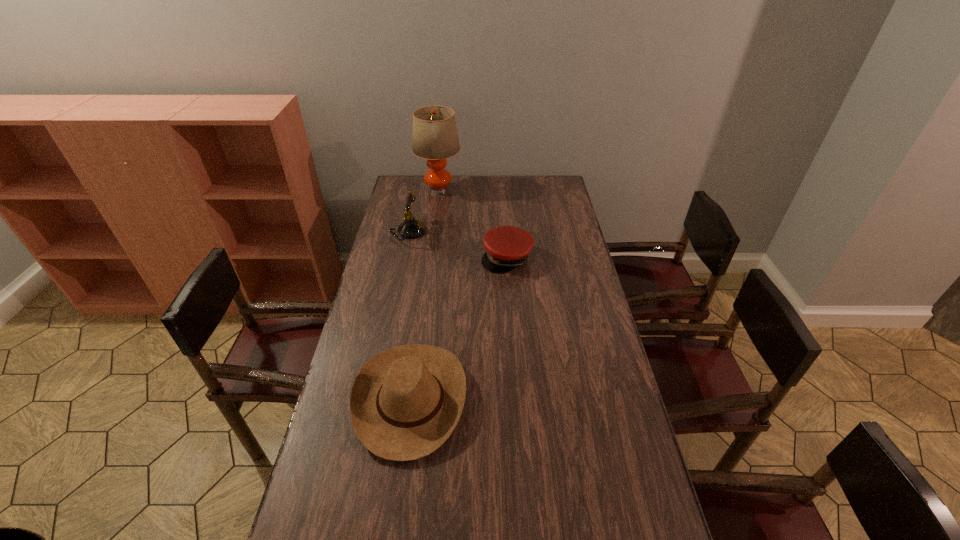
You are a GUI agent. You are given a task and a screenshot of the screen. Output one action in this format:
    pyautogui.click(x=<x>, y=<y>)
    Task: Click on the tallest object
    
    Given the screenshot: What is the action you would take?
    pyautogui.click(x=435, y=137)

Where is `the farthest object`? Image resolution: width=960 pixels, height=540 pixels. the farthest object is located at coordinates (435, 137).

Identify the location of telephone. (411, 228).

Identify the location of the nearest object. The image size is (960, 540). (405, 402).

Where is `the shortest object`? This screenshot has height=540, width=960. the shortest object is located at coordinates (507, 247).

This screenshot has width=960, height=540. In order to click on cap in this screenshot , I will do pyautogui.click(x=507, y=247).

I want to click on vacant space situated on the right of the lamp, so click(x=498, y=189).

Locate an element on the screen. vacant area situated on the dial of the telephone is located at coordinates (443, 232).

Find the location of a particular element. vacant area situated on the front-facing side of the cowboy hat is located at coordinates (598, 400).

In order to click on vacant space located 0.240m at the front of the rightmost object where the visor is located in this screenshot , I will do (512, 317).